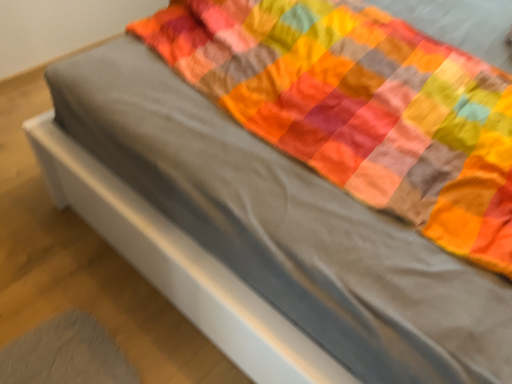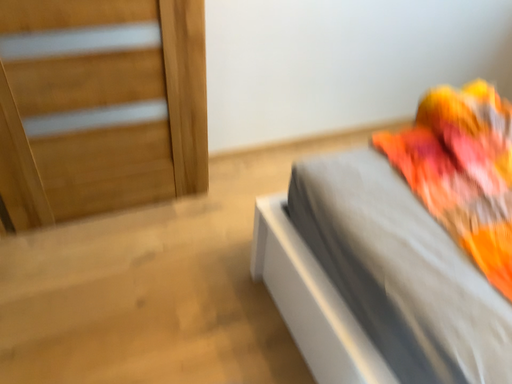
Question: Which way did the camera rotate in the video?

Choices:
 (A) rotated left
 (B) rotated right

Answer: (A)